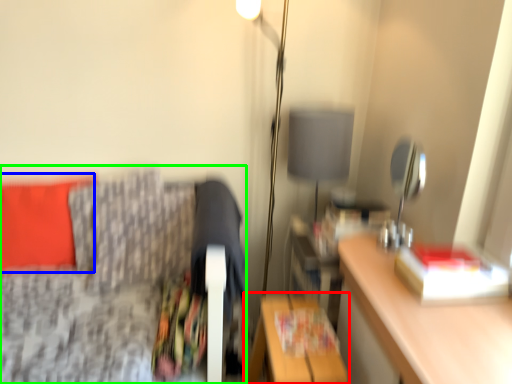
Question: Which object is positioned farthest from table (highlighted by a red box)? Select from pillow (highlighted by a blue box) and furniture (highlighted by a green box).

Choices:
 (A) pillow
 (B) furniture

Answer: (A)